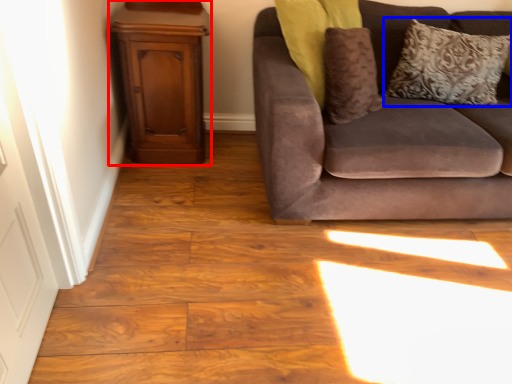
Question: Which object is further to the camera taking this photo, dresser (highlighted by a red box) or pillow (highlighted by a blue box)?

Choices:
 (A) dresser
 (B) pillow

Answer: (B)